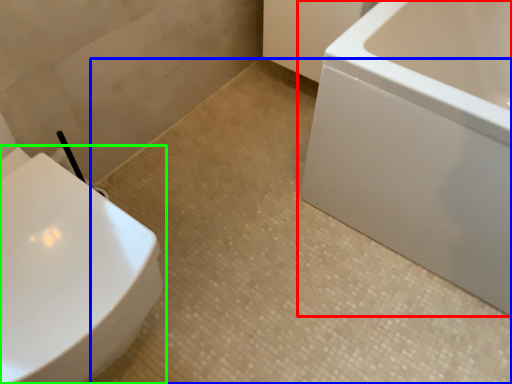
Question: Estimate the real-world distances between objects in this image. Which object is closer to bathtub (highlighted by a red box), ceramic tile (highlighted by a blue box) or toilet (highlighted by a green box)?

Choices:
 (A) ceramic tile
 (B) toilet

Answer: (A)